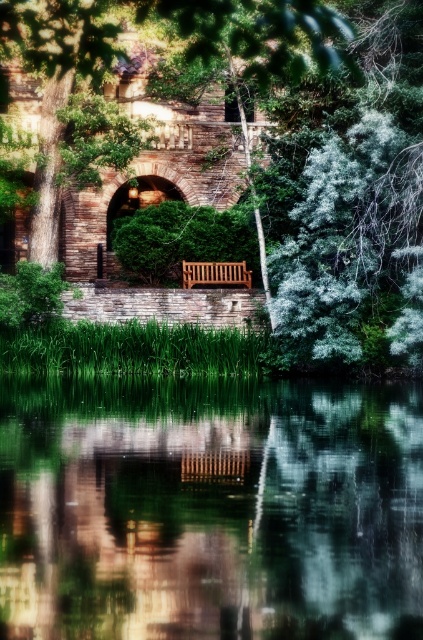
You are standing at the edge of the scene and want to sit on the wooden bench against the stone wall. If you look towards the center, which object do you see first, the green reflective water at center or the green leafy tree at center?

You will see the green reflective water at center first because it is positioned to the left of the green leafy tree at center, so it appears closer to your line of sight when looking towards the center.

You are planning to place a small garden statue that is 1 meter wide between the green reflective water at center and the teak wood bench at center. Based on their widths, will the statue fit between them?

The green reflective water at center might be wider than the teak wood bench at center, so the statue may or may not fit depending on the exact width of the water. Further measurement is needed to confirm.